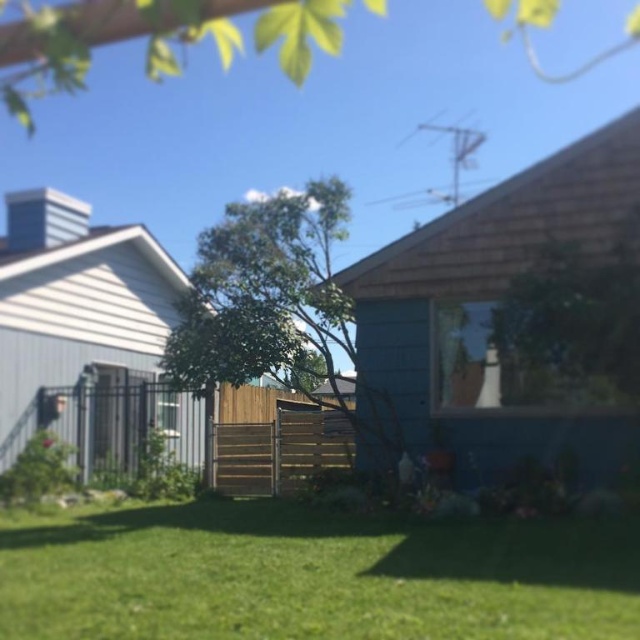
Question: Is green grass at lower center above brown wooden fence at center?

Choices:
 (A) no
 (B) yes

Answer: (A)

Question: Can you confirm if green leafy tree at upper center is positioned above brown wooden fence at center?

Choices:
 (A) no
 (B) yes

Answer: (B)

Question: Among these points, which one is nearest to the camera?

Choices:
 (A) (86, 4)
 (B) (227, 428)
 (C) (230, 378)
 (D) (164, 529)

Answer: (A)

Question: Can you confirm if green leafy tree at center is positioned below green leafy tree at upper center?

Choices:
 (A) no
 (B) yes

Answer: (B)

Question: Based on their relative distances, which object is farther from the green leafy tree at center?

Choices:
 (A) green leafy tree at upper center
 (B) brown wooden fence at center
 (C) green grass at lower center

Answer: (C)

Question: Which object appears farthest from the camera in this image?

Choices:
 (A) green leafy tree at center
 (B) green leafy tree at upper center
 (C) brown wooden fence at center

Answer: (C)